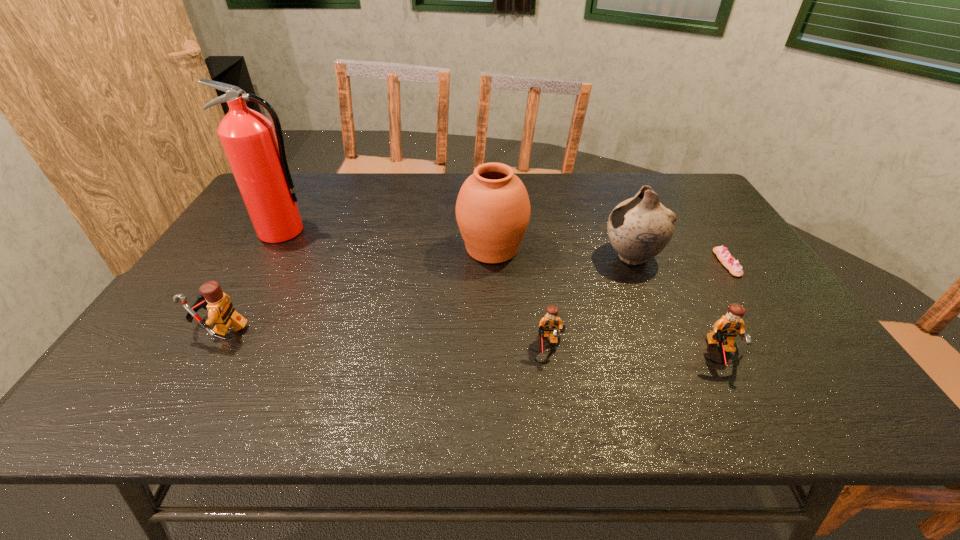
What are the coordinates of `the rightmost object` in the screenshot? It's located at (722, 253).

Locate an element on the screen. Image resolution: width=960 pixels, height=540 pixels. vacant space situated 0.080m holding a crossbow in the hands of the tallest Lego is located at coordinates (159, 328).

At what (x,y) coordinates should I click in order to perform the action: click on free spot located at the nozzle of the tallest object. Please return your answer as a coordinate pair (x, y). Image resolution: width=960 pixels, height=540 pixels. Looking at the image, I should click on click(x=219, y=341).

Find the location of a particular element. This screenshot has width=960, height=540. vacant space located from the spout of the pottery is located at coordinates (489, 256).

I want to click on free space located 0.260m from the spout of the pottery, so click(510, 256).

Where is `blank area located 0.270m from the spout of the pottery`? blank area located 0.270m from the spout of the pottery is located at coordinates (506, 256).

This screenshot has height=540, width=960. I want to click on free space located 0.340m on the right of the urn, so click(645, 248).

I want to click on free space located on the left of the shortest object, so click(x=639, y=263).

Identify the location of Lego at the left edge. The image size is (960, 540). (221, 312).

Where is `fire extinguisher located in the left edge section of the desktop`? The image size is (960, 540). fire extinguisher located in the left edge section of the desktop is located at coordinates (257, 157).